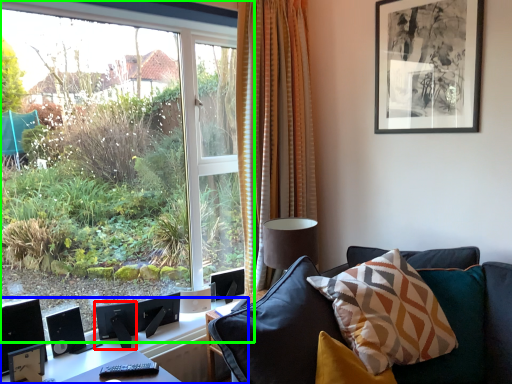
Question: Considering the real-world distances, which object is farthest from speaker (highlighted by a red box)? table (highlighted by a blue box) or window (highlighted by a green box)?

Choices:
 (A) table
 (B) window

Answer: (B)